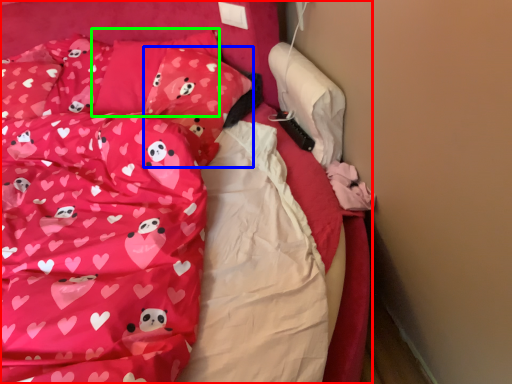
Question: Based on their relative distances, which object is nearer to bed (highlighted by a red box)? Choose from pillow (highlighted by a blue box) and pillow (highlighted by a green box).

Choices:
 (A) pillow
 (B) pillow

Answer: (A)